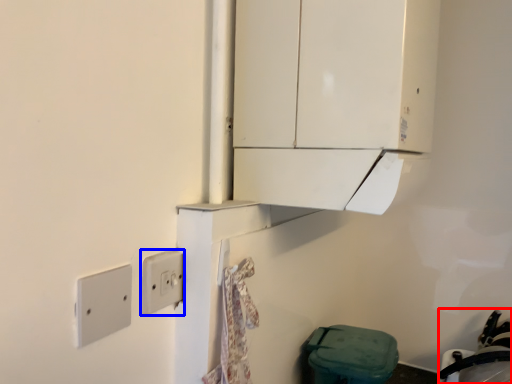
Question: Which object appears farthest to the camera in this image, sink (highlighted by a red box) or light switch (highlighted by a blue box)?

Choices:
 (A) sink
 (B) light switch

Answer: (A)